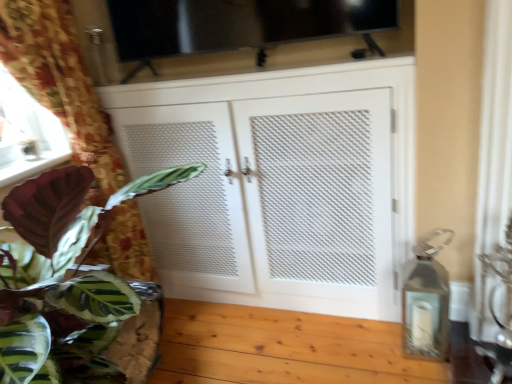
Question: Are green leafy plant at left and floral fabric curtain at left, arranged as the 1th curtain when viewed from the left, beside each other?

Choices:
 (A) yes
 (B) no

Answer: (B)

Question: Is green leafy plant at left facing away from floral fabric curtain at left, arranged as the 1th curtain when viewed from the left?

Choices:
 (A) yes
 (B) no

Answer: (B)

Question: Is green leafy plant at left not within floral fabric curtain at left, marked as the 2th curtain in a right-to-left arrangement?

Choices:
 (A) no
 (B) yes

Answer: (B)

Question: Can you confirm if green leafy plant at left is positioned to the left of floral fabric curtain at left, arranged as the 1th curtain when viewed from the left?

Choices:
 (A) yes
 (B) no

Answer: (B)

Question: Considering the relative sizes of green leafy plant at left and floral fabric curtain at left, arranged as the 1th curtain when viewed from the left, in the image provided, is green leafy plant at left taller than floral fabric curtain at left, arranged as the 1th curtain when viewed from the left,?

Choices:
 (A) no
 (B) yes

Answer: (A)

Question: Considering the positions of matte brown wood at lower left and white textured cabinet at center in the image, is matte brown wood at lower left bigger or smaller than white textured cabinet at center?

Choices:
 (A) big
 (B) small

Answer: (B)

Question: From a real-world perspective, relative to white textured cabinet at center, is matte brown wood at lower left vertically above or below?

Choices:
 (A) below
 (B) above

Answer: (B)

Question: Is matte brown wood at lower left in front of or behind white textured cabinet at center in the image?

Choices:
 (A) behind
 (B) front

Answer: (A)

Question: Based on their positions, is matte brown wood at lower left located to the left or right of white textured cabinet at center?

Choices:
 (A) right
 (B) left

Answer: (B)

Question: Considering the positions of floral fabric curtain at left, marked as the 2th curtain in a right-to-left arrangement, and matte brown wood at lower left in the image, is floral fabric curtain at left, marked as the 2th curtain in a right-to-left arrangement, bigger or smaller than matte brown wood at lower left?

Choices:
 (A) small
 (B) big

Answer: (B)

Question: Visually, is floral fabric curtain at left, marked as the 2th curtain in a right-to-left arrangement, positioned to the left or to the right of matte brown wood at lower left?

Choices:
 (A) right
 (B) left

Answer: (A)

Question: Considering the positions of floral fabric curtain at left, marked as the 2th curtain in a right-to-left arrangement, and matte brown wood at lower left in the image, is floral fabric curtain at left, marked as the 2th curtain in a right-to-left arrangement, wider or thinner than matte brown wood at lower left?

Choices:
 (A) thin
 (B) wide

Answer: (B)

Question: In terms of height, does floral fabric curtain at left, arranged as the 1th curtain when viewed from the left, look taller or shorter compared to matte brown wood at lower left?

Choices:
 (A) short
 (B) tall

Answer: (B)

Question: From the image's perspective, is white textured cabinet at center located above or below matte brown wood at lower left?

Choices:
 (A) below
 (B) above

Answer: (A)

Question: Is white textured cabinet at center inside or outside of matte brown wood at lower left?

Choices:
 (A) outside
 (B) inside

Answer: (A)